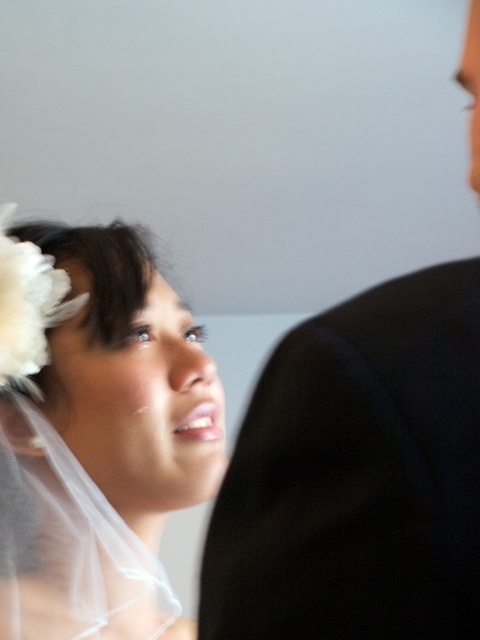
Question: Which object is farther from the camera taking this photo?

Choices:
 (A) white sheer veil at upper left
 (B) black fabric at right

Answer: (A)

Question: Which point is farther from the camera taking this photo?

Choices:
 (A) (205, 499)
 (B) (262, 500)
 (C) (40, 336)

Answer: (C)

Question: Can you confirm if black fabric at right is smaller than white sheer veil at upper left?

Choices:
 (A) no
 (B) yes

Answer: (B)

Question: Is white sheer veil at upper left to the right of white feather at upper left from the viewer's perspective?

Choices:
 (A) yes
 (B) no

Answer: (A)

Question: Can you confirm if black fabric at right is bigger than white feather at upper left?

Choices:
 (A) yes
 (B) no

Answer: (A)

Question: Based on their relative distances, which object is farther from the white feather at upper left?

Choices:
 (A) white sheer veil at upper left
 (B) black fabric at right

Answer: (B)